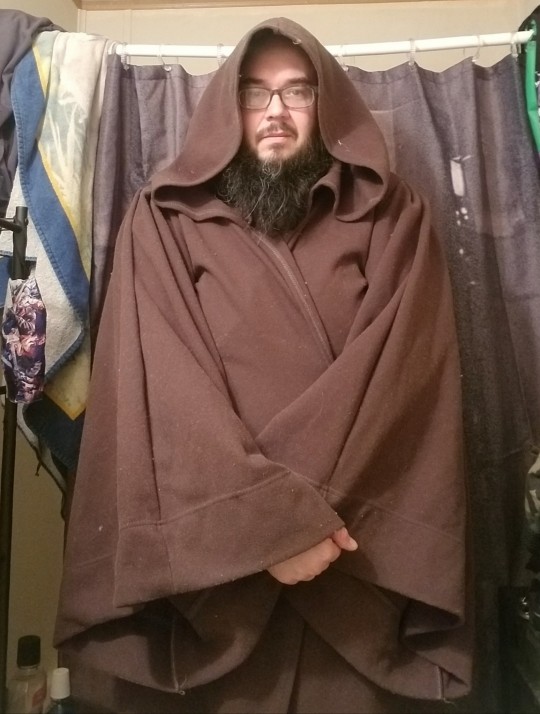
At what (x,y) coordinates should I click in order to perform the action: click on towel. Please return your answer as a coordinate pair (x, y). This screenshot has width=540, height=714. Looking at the image, I should click on (48, 216).